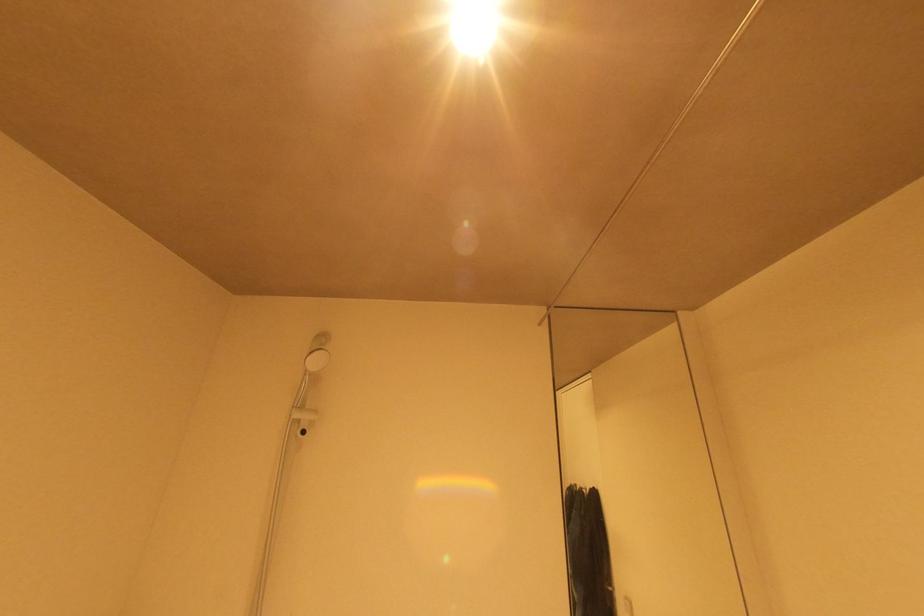
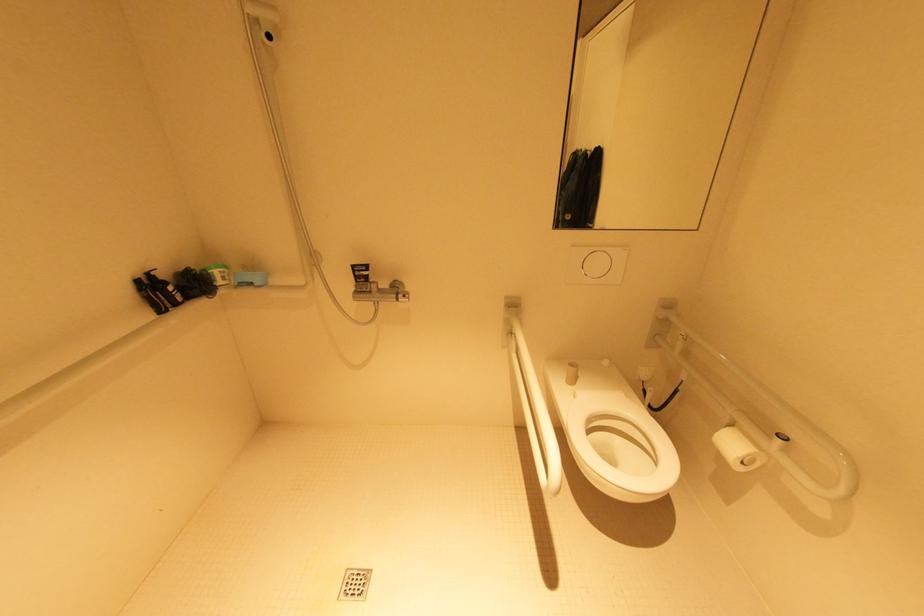
Question: Based on the continuous images, in which direction is the camera rotating? Reply with the corresponding letter.

Choices:
 (A) Left
 (B) Right
 (C) Up
 (D) Down

Answer: (D)